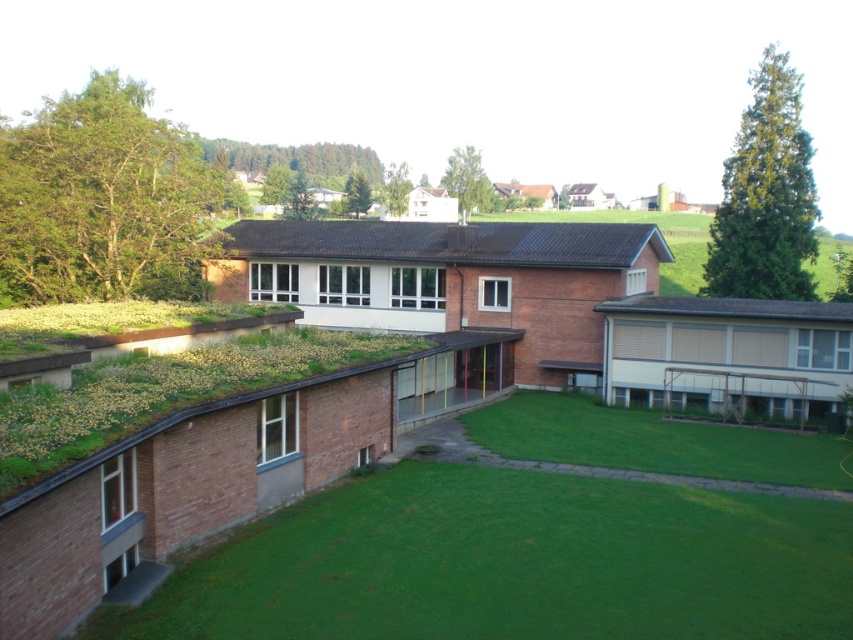
Question: Estimate the real-world distances between objects in this image. Which object is farther from the black tile roof at center?

Choices:
 (A) green grass at lower left
 (B) gray shingles at upper right

Answer: (A)

Question: Can you confirm if green grass at lower left is thinner than black tile roof at center?

Choices:
 (A) no
 (B) yes

Answer: (B)

Question: Can you confirm if green grass at lower left is thinner than black tile roof at center?

Choices:
 (A) yes
 (B) no

Answer: (A)

Question: Which of the following is the closest to the observer?

Choices:
 (A) (795, 502)
 (B) (527, 257)

Answer: (A)

Question: Among these objects, which one is nearest to the camera?

Choices:
 (A) black tile roof at center
 (B) green grass at lower left
 (C) gray shingles at upper right

Answer: (B)

Question: Is green grass at lower left to the right of black tile roof at center from the viewer's perspective?

Choices:
 (A) yes
 (B) no

Answer: (A)